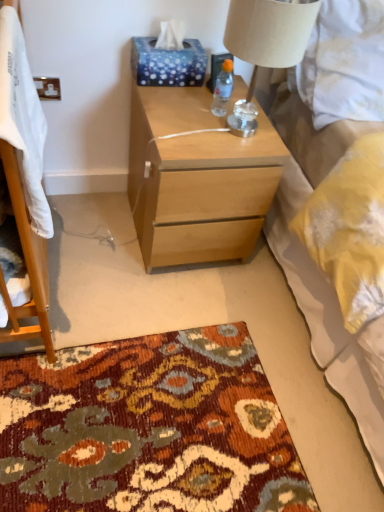
Image resolution: width=384 pixels, height=512 pixels. I want to click on free space on the front side of blue dotted tissue at upper center, so click(x=168, y=101).